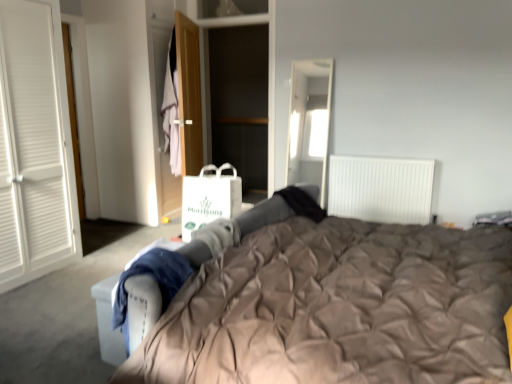
The height and width of the screenshot is (384, 512). What are the coordinates of `vacant point above white plastic radiator at upper right (from a real-world perspective)` in the screenshot? It's located at (378, 157).